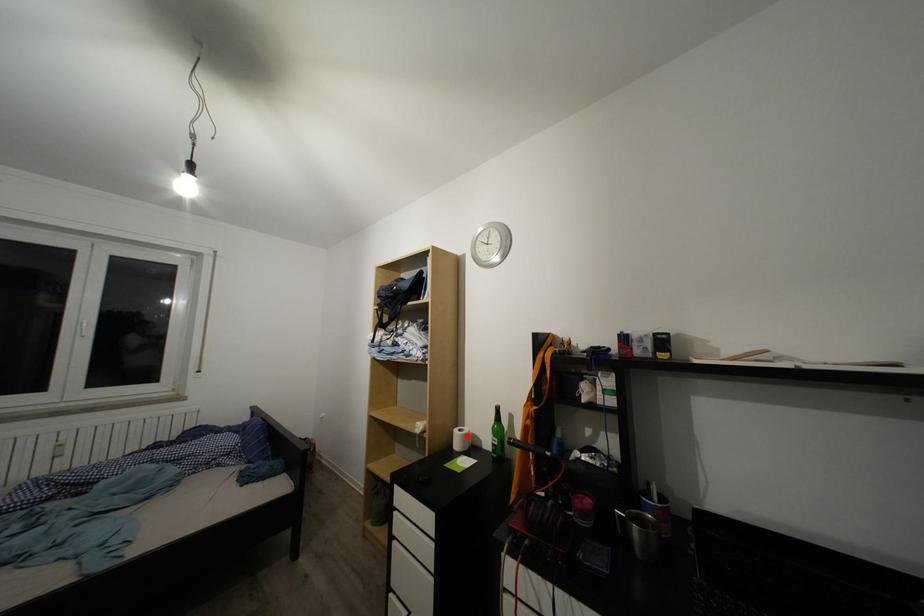
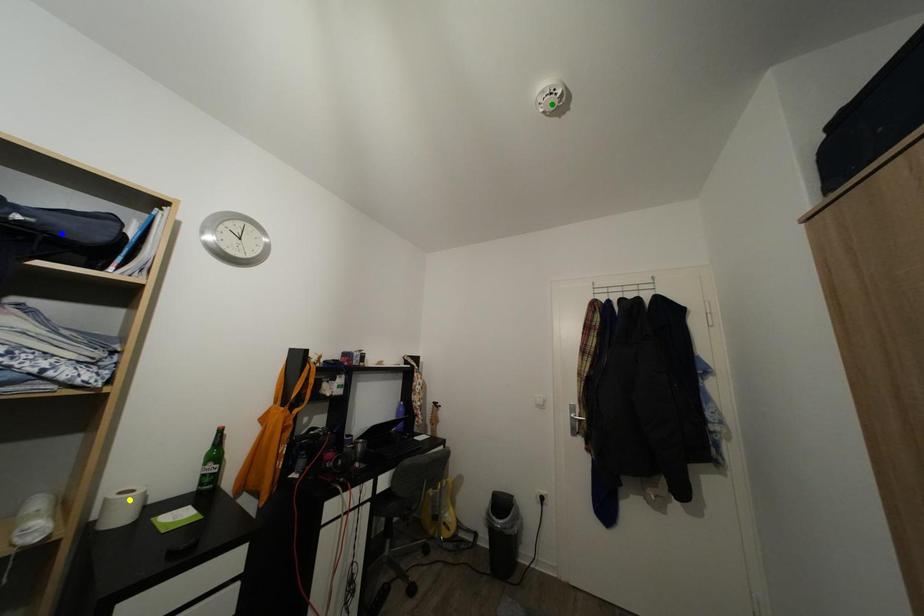
Question: I am providing you with two images of the same scene from different viewpoints. A red point is marked on the first image. You are given multiple points on the second image. Can you choose the point in image 2 that corresponds to the point in image 1?

Choices:
 (A) blue point
 (B) green point
 (C) yellow point

Answer: (C)